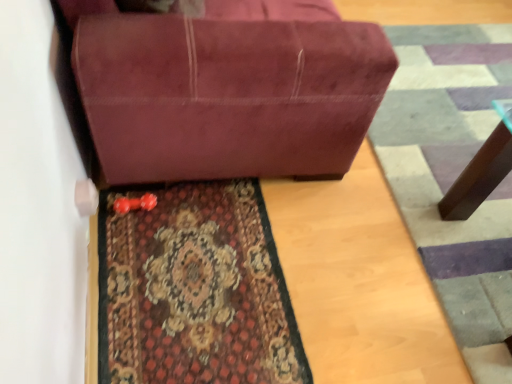
Question: Considering the relative sizes of carpeted rug at lower center and carpeted doormat at lower right in the image provided, is carpeted rug at lower center bigger than carpeted doormat at lower right?

Choices:
 (A) no
 (B) yes

Answer: (A)

Question: Can you see carpeted rug at lower center touching carpeted doormat at lower right?

Choices:
 (A) yes
 (B) no

Answer: (B)

Question: Is carpeted rug at lower center facing away from carpeted doormat at lower right?

Choices:
 (A) yes
 (B) no

Answer: (B)

Question: Can you confirm if carpeted rug at lower center is taller than carpeted doormat at lower right?

Choices:
 (A) no
 (B) yes

Answer: (A)

Question: Does carpeted rug at lower center come behind carpeted doormat at lower right?

Choices:
 (A) yes
 (B) no

Answer: (B)

Question: From the image's perspective, is carpeted rug at lower center above or below carpeted doormat at lower right?

Choices:
 (A) above
 (B) below

Answer: (B)

Question: Is carpeted rug at lower center taller or shorter than carpeted doormat at lower right?

Choices:
 (A) tall
 (B) short

Answer: (B)

Question: Is carpeted rug at lower center to the left or to the right of carpeted doormat at lower right in the image?

Choices:
 (A) right
 (B) left

Answer: (B)

Question: From a real-world perspective, is carpeted rug at lower center above or below carpeted doormat at lower right?

Choices:
 (A) below
 (B) above

Answer: (A)

Question: From a real-world perspective, is suede-like maroon couch at center physically located above or below carpeted doormat at lower right?

Choices:
 (A) above
 (B) below

Answer: (A)

Question: Is suede-like maroon couch at center bigger or smaller than carpeted doormat at lower right?

Choices:
 (A) small
 (B) big

Answer: (B)

Question: From the image's perspective, is suede-like maroon couch at center positioned above or below carpeted doormat at lower right?

Choices:
 (A) below
 (B) above

Answer: (B)

Question: Looking at their shapes, would you say suede-like maroon couch at center is wider or thinner than carpeted doormat at lower right?

Choices:
 (A) thin
 (B) wide

Answer: (A)

Question: In the image, is carpeted rug at lower center positioned in front of or behind suede-like maroon couch at center?

Choices:
 (A) behind
 (B) front

Answer: (A)

Question: Considering the positions of carpeted rug at lower center and suede-like maroon couch at center in the image, is carpeted rug at lower center bigger or smaller than suede-like maroon couch at center?

Choices:
 (A) big
 (B) small

Answer: (B)